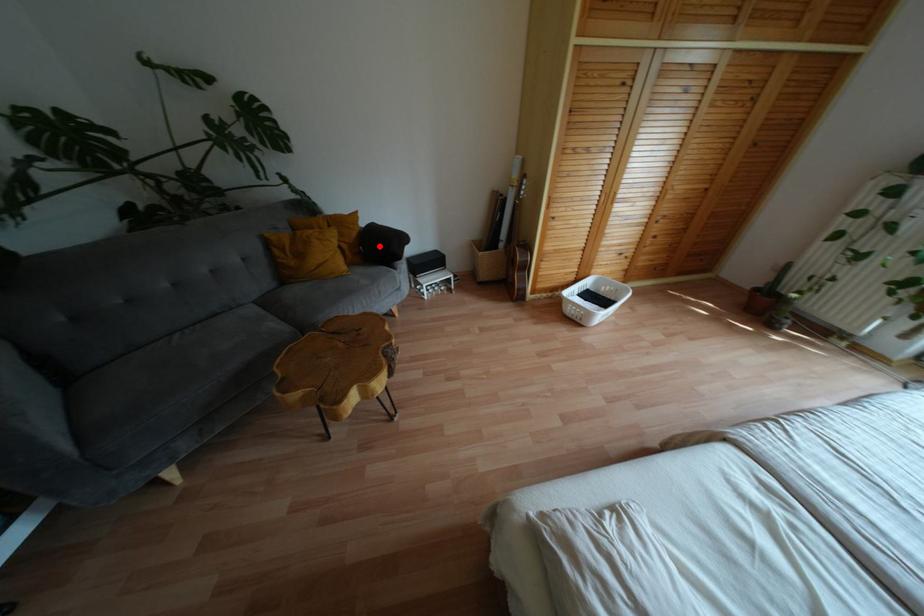
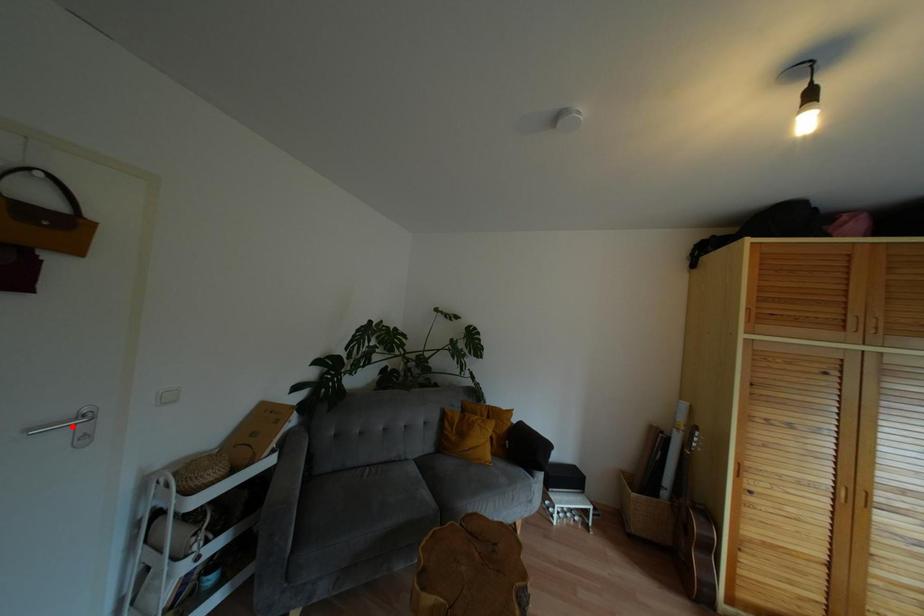
I am providing you with two images of the same scene from different viewpoints. A red point is marked on the first image and another point is marked on the second image. Are the points marked in image1 and image2 representing the same 3D position?

No